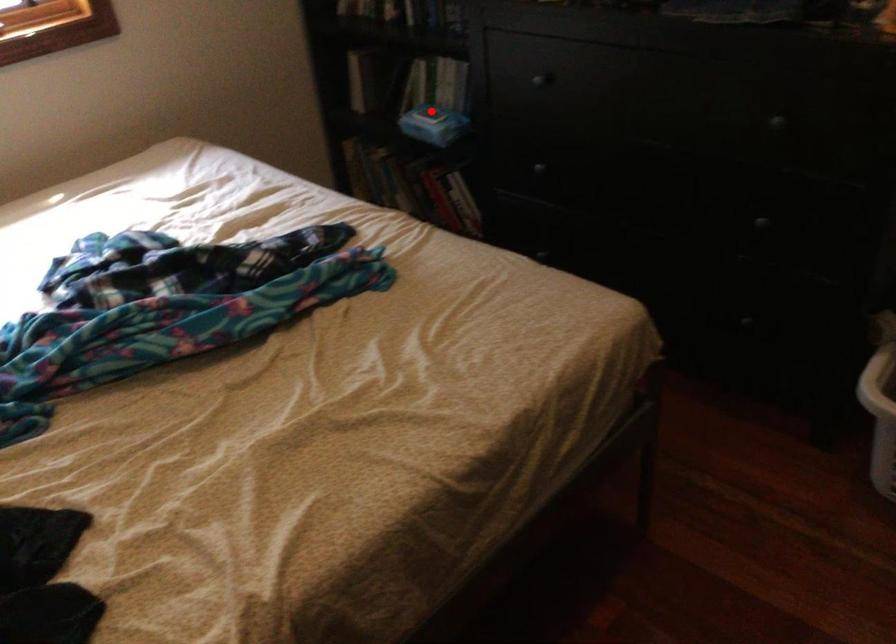
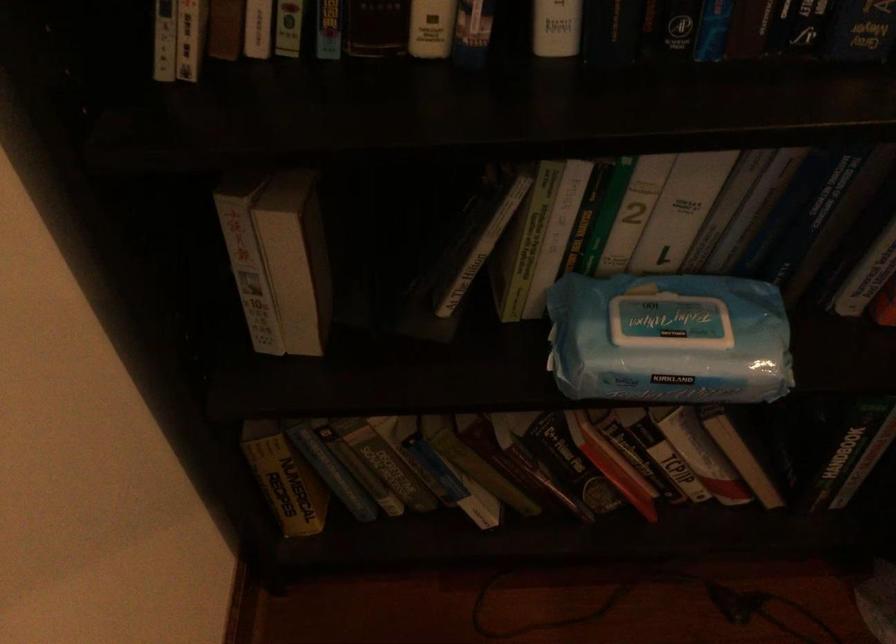
In the second image, find the point that corresponds to the highlighted location in the first image.

(673, 317)